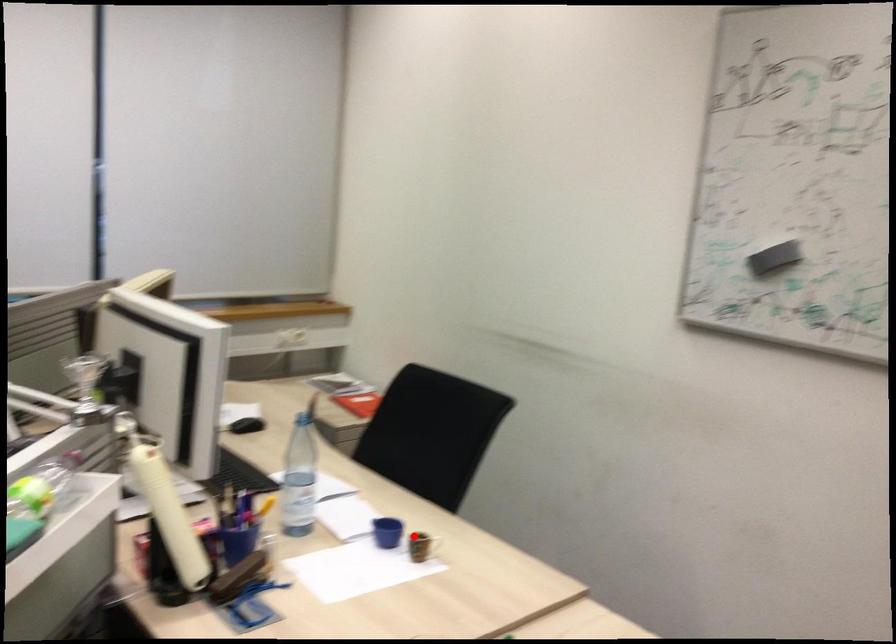
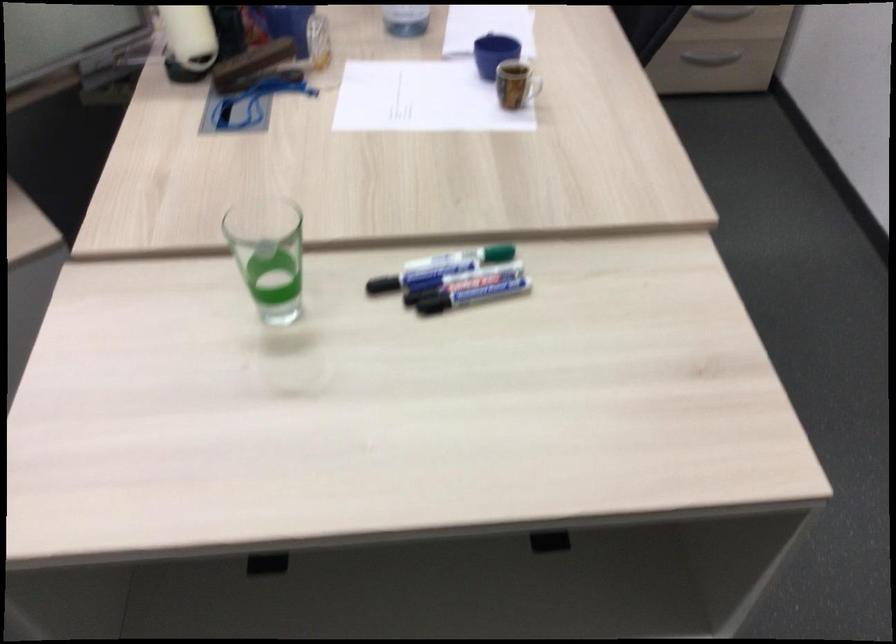
Question: A red point is marked in image1. In image2, is the corresponding 3D point closer to the camera or farther? Reply with the corresponding letter.

Choices:
 (A) The corresponding 3D point is closer.
 (B) The corresponding 3D point is farther.

Answer: (A)